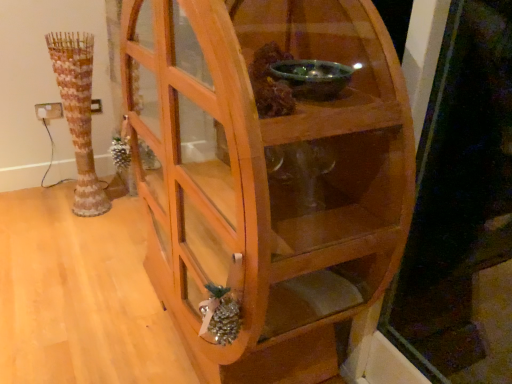
You are a GUI agent. You are given a task and a screenshot of the screen. Output one action in this format:
    pyautogui.click(x=<x>, y=<y>)
    Task: Click on the free space above wooden textured vase at left (from a real-world perspective)
    This screenshot has height=384, width=512.
    Given the screenshot: What is the action you would take?
    pyautogui.click(x=62, y=38)